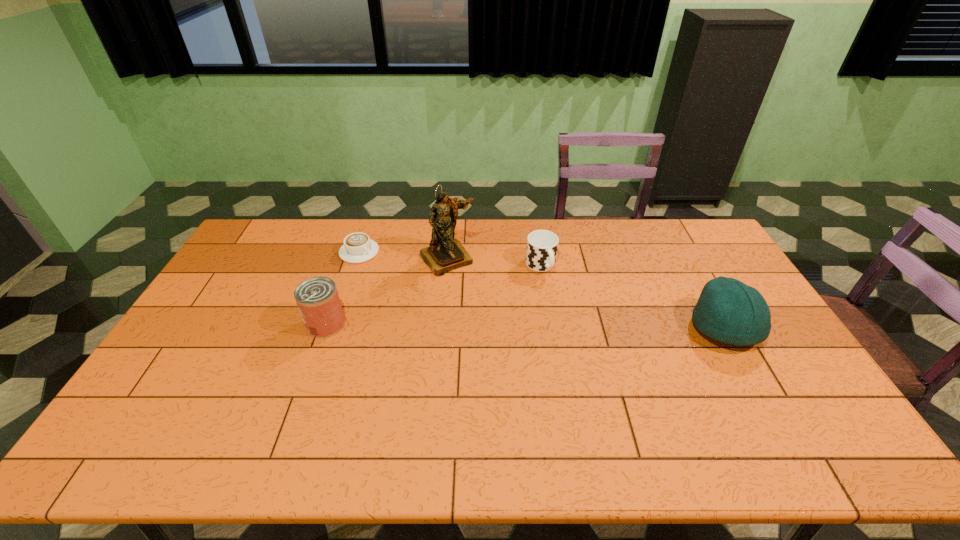
The width and height of the screenshot is (960, 540). I want to click on unoccupied area between the rightmost object and the can, so click(525, 326).

Identify the location of vacant space that's between the third object from right to left and the cappuccino. The width and height of the screenshot is (960, 540). (403, 255).

The width and height of the screenshot is (960, 540). What are the coordinates of `vacant area between the cappuccino and the can` in the screenshot? It's located at (343, 288).

Identify the location of vacant point located between the second object from right to left and the tallest object. (494, 262).

This screenshot has height=540, width=960. In order to click on empty space that is in between the can and the rightmost object in this screenshot , I will do `click(525, 326)`.

Find the location of a particular element. free space between the second object from right to left and the third object from left to right is located at coordinates (494, 262).

The image size is (960, 540). I want to click on object that is the closest to the cup, so click(x=445, y=253).

At what (x,y) coordinates should I click in order to perform the action: click on object that is the fourth closest to the can. Please return your answer as a coordinate pair (x, y). Image resolution: width=960 pixels, height=540 pixels. Looking at the image, I should click on (727, 310).

The image size is (960, 540). Identify the location of vacant space that satisfies the following two spatial constraints: 1. on the back side of the can; 2. on the left side of the cappuccino. (351, 252).

Where is `vacant point that satisfies the following two spatial constraints: 1. on the back side of the can; 2. on the left side of the shortest object`? vacant point that satisfies the following two spatial constraints: 1. on the back side of the can; 2. on the left side of the shortest object is located at coordinates (351, 252).